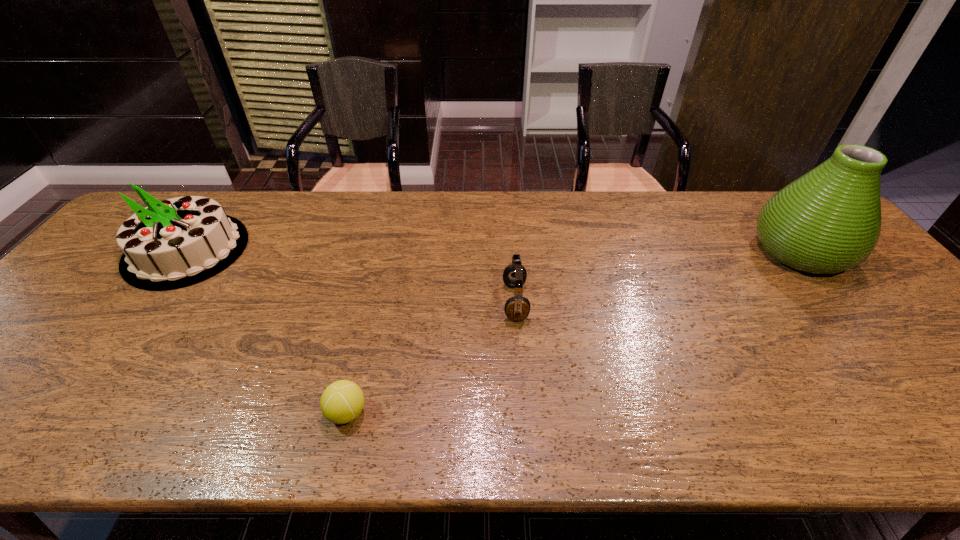
Find the location of `vacant region between the birthday cake and the vase`. vacant region between the birthday cake and the vase is located at coordinates (493, 251).

The height and width of the screenshot is (540, 960). I want to click on vacant point located between the leftmost object and the tallest object, so click(x=493, y=251).

Where is `vacant space that's between the birthday cake and the shortest object`? The width and height of the screenshot is (960, 540). vacant space that's between the birthday cake and the shortest object is located at coordinates (267, 331).

Where is `vacant region between the tallest object and the third object from right to left`? The height and width of the screenshot is (540, 960). vacant region between the tallest object and the third object from right to left is located at coordinates (573, 332).

Where is `free space between the tallest object and the headset`? This screenshot has width=960, height=540. free space between the tallest object and the headset is located at coordinates (658, 276).

Point out which object is positioned as the second nearest to the leftmost object. Please provide its 2D coordinates. Your answer should be formatted as a tuple, i.e. [(x, y)], where the tuple contains the x and y coordinates of a point satisfying the conditions above.

[(517, 308)]

This screenshot has height=540, width=960. I want to click on object that is the third closest one to the vase, so click(175, 243).

I want to click on vacant area that satisfies the following two spatial constraints: 1. on the front side of the tallest object; 2. on the ear cups of the headset, so click(x=840, y=302).